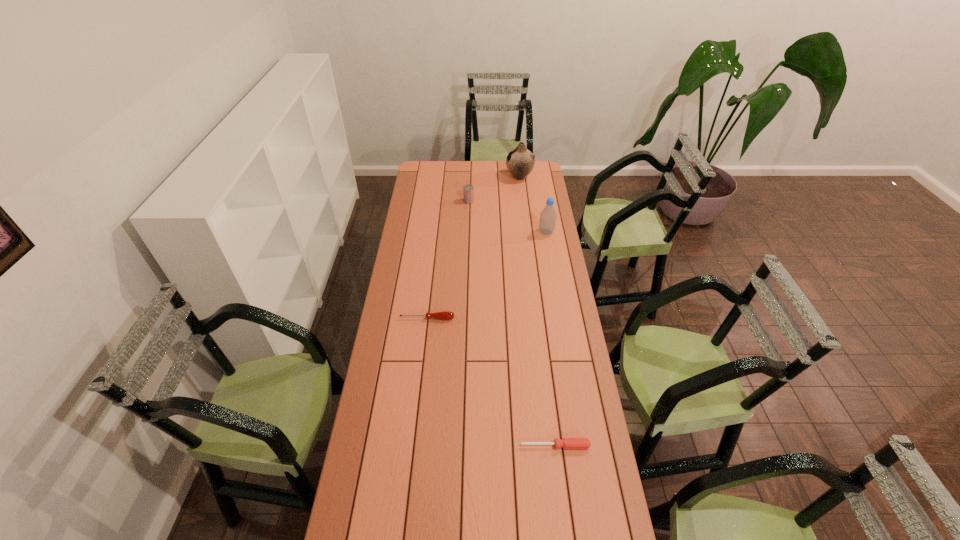
Locate an element on the screen. The image size is (960, 540). free spot between the pottery and the nearer screwdriver is located at coordinates (538, 311).

Identify the location of vacant space that is in between the farther screwdriver and the bottle. Image resolution: width=960 pixels, height=540 pixels. (487, 275).

The height and width of the screenshot is (540, 960). In order to click on free point between the fourth farthest object and the nearest object in this screenshot , I will do `click(492, 382)`.

Image resolution: width=960 pixels, height=540 pixels. Find the location of `free area in between the bottle and the leftmost object`. free area in between the bottle and the leftmost object is located at coordinates (487, 275).

Where is `vacant space in between the left screwdriver and the pottery`? The height and width of the screenshot is (540, 960). vacant space in between the left screwdriver and the pottery is located at coordinates (473, 247).

Where is `object that is the second nearest to the nearer screwdriver`? Image resolution: width=960 pixels, height=540 pixels. object that is the second nearest to the nearer screwdriver is located at coordinates (548, 216).

Find the location of `object that is the second closest one to the bottle`. object that is the second closest one to the bottle is located at coordinates (520, 161).

Where is `vacant space that satisfies the following two spatial constraints: 1. on the front side of the second object from left to right; 2. on the left side of the nearer screwdriver`? This screenshot has height=540, width=960. vacant space that satisfies the following two spatial constraints: 1. on the front side of the second object from left to right; 2. on the left side of the nearer screwdriver is located at coordinates (461, 446).

You are a GUI agent. You are given a task and a screenshot of the screen. Output one action in this format:
    pyautogui.click(x=<x>, y=<y>)
    Task: Click on the free space that satisfies the following two spatial constraints: 1. on the back side of the nearest object; 2. from the spout of the farthest object
    The image size is (960, 540).
    Given the screenshot: What is the action you would take?
    pyautogui.click(x=521, y=177)

Identify the location of vacant space that satisfies the following two spatial constraints: 1. on the back side of the bottle; 2. from the spout of the pottery. (537, 177).